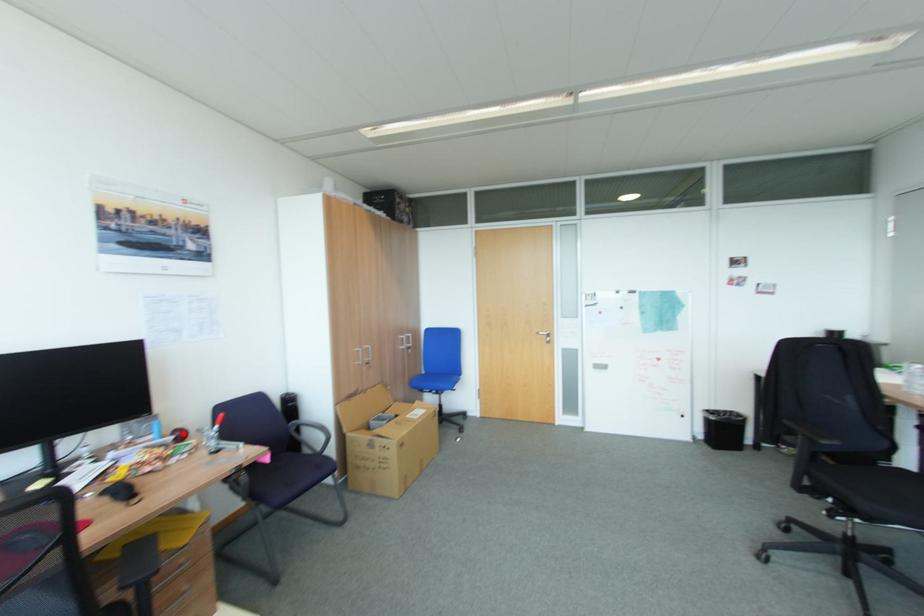
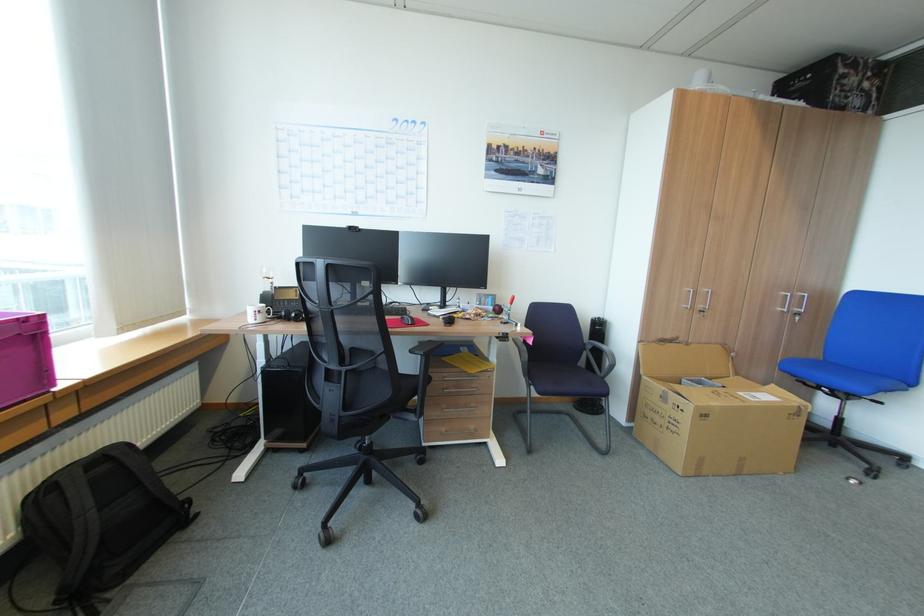
Where in the second image is the point corresponding to the highlighted location from the first image?

(502, 307)